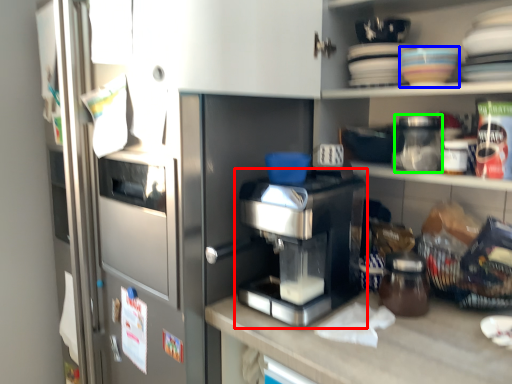
Question: Which is nearer to the home appliance (highlighted by a red box)? tableware (highlighted by a blue box) or glass jar (highlighted by a green box).

Choices:
 (A) tableware
 (B) glass jar

Answer: (B)